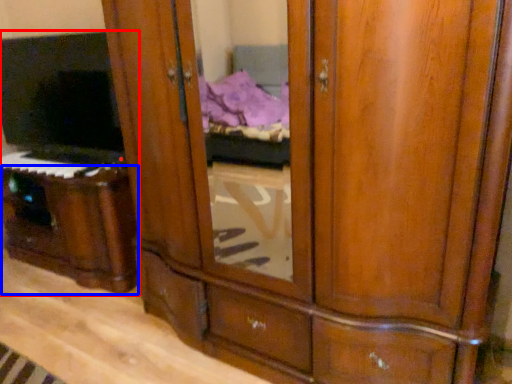
Question: Among these objects, which one is nearest to the camera, entertainment center (highlighted by a red box) or vanity (highlighted by a blue box)?

Choices:
 (A) entertainment center
 (B) vanity

Answer: (A)